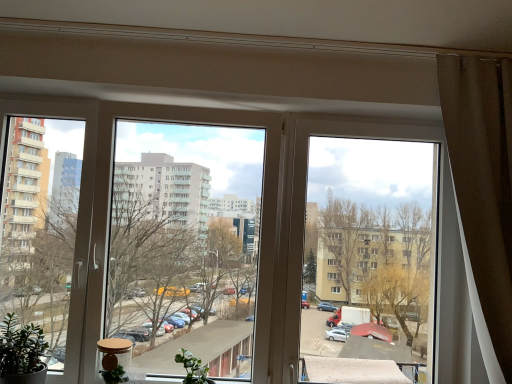
At what (x,y) coordinates should I click in order to perform the action: click on green matte plant at lower center, which appears as the 2th plant when viewed from the left. Please return your answer as a coordinate pair (x, y). Looking at the image, I should click on (193, 368).

This screenshot has height=384, width=512. What are the coordinates of `transparent glass window at center, acting as the second window starting from the left` in the screenshot? It's located at (367, 251).

Would you say green matte plant at lower center, which appears as the 2th plant when viewed from the left, is inside or outside green matte plant at lower left, placed as the second plant when sorted from right to left?

green matte plant at lower center, which appears as the 2th plant when viewed from the left, is outside green matte plant at lower left, placed as the second plant when sorted from right to left.

Is green matte plant at lower center, which appears as the 2th plant when viewed from the left, oriented away from green matte plant at lower left, arranged as the first plant when viewed from the left?

green matte plant at lower center, which appears as the 2th plant when viewed from the left, is not turned away from green matte plant at lower left, arranged as the first plant when viewed from the left.

Considering the relative sizes of green matte plant at lower center, which appears as the 2th plant when viewed from the left, and green matte plant at lower left, placed as the second plant when sorted from right to left, in the image provided, is green matte plant at lower center, which appears as the 2th plant when viewed from the left, bigger than green matte plant at lower left, placed as the second plant when sorted from right to left,?

Actually, green matte plant at lower center, which appears as the 2th plant when viewed from the left, might be smaller than green matte plant at lower left, placed as the second plant when sorted from right to left.

From the image's perspective, is green matte plant at lower center, which appears as the 2th plant when viewed from the left, located beneath green matte plant at lower left, arranged as the first plant when viewed from the left?

Correct, green matte plant at lower center, which appears as the 2th plant when viewed from the left, appears lower than green matte plant at lower left, arranged as the first plant when viewed from the left, in the image.

From the picture: Can you confirm if green matte plant at lower left, arranged as the first plant when viewed from the left, is bigger than transparent glass window at center, the 1th window from the right?

Actually, green matte plant at lower left, arranged as the first plant when viewed from the left, might be smaller than transparent glass window at center, the 1th window from the right.

From the image's perspective, is green matte plant at lower left, placed as the second plant when sorted from right to left, over transparent glass window at center, the 1th window from the right?

No, from the image's perspective, green matte plant at lower left, placed as the second plant when sorted from right to left, is not above transparent glass window at center, the 1th window from the right.

Is green matte plant at lower left, placed as the second plant when sorted from right to left, wider than transparent glass window at center, acting as the second window starting from the left?

Correct, the width of green matte plant at lower left, placed as the second plant when sorted from right to left, exceeds that of transparent glass window at center, acting as the second window starting from the left.

Is transparent glass window at center, acting as the second window starting from the left, surrounded by green matte plant at lower left, placed as the second plant when sorted from right to left?

No, green matte plant at lower left, placed as the second plant when sorted from right to left, does not contain transparent glass window at center, acting as the second window starting from the left.

Is transparent plastic window at center, which is counted as the 2th window, starting from the right, far from green matte plant at lower left, placed as the second plant when sorted from right to left?

Absolutely, transparent plastic window at center, which is counted as the 2th window, starting from the right, is distant from green matte plant at lower left, placed as the second plant when sorted from right to left.

Which is closer to the camera, (56, 315) or (15, 336)?

Point (56, 315).

Is transparent plastic window at center, which is counted as the 2th window, starting from the right, looking in the opposite direction of green matte plant at lower left, arranged as the first plant when viewed from the left?

Yes, transparent plastic window at center, which is counted as the 2th window, starting from the right, is positioned with its back facing green matte plant at lower left, arranged as the first plant when viewed from the left.

Is transparent plastic window at center, which is counted as the 2th window, starting from the right, smaller than green matte plant at lower left, arranged as the first plant when viewed from the left?

No, transparent plastic window at center, which is counted as the 2th window, starting from the right, is not smaller than green matte plant at lower left, arranged as the first plant when viewed from the left.

Would you say transparent glass window at center, acting as the second window starting from the left, is outside transparent plastic window at center, the 1th window when ordered from left to right?

Yes.

In the image, is transparent glass window at center, the 1th window from the right, on the left side or the right side of transparent plastic window at center, the 1th window when ordered from left to right?

Clearly, transparent glass window at center, the 1th window from the right, is on the right of transparent plastic window at center, the 1th window when ordered from left to right, in the image.

Which is less distant, [364,344] or [150,215]?

Point [364,344]

Find the location of a particular element. The image size is (512, 384). window that appears below the transparent glass window at center, the 1th window from the right (from a real-world perspective) is located at coordinates 156,234.

Does green matte plant at lower left, arranged as the first plant when viewed from the left, have a greater height compared to green matte plant at lower center, marked as the first plant in a right-to-left arrangement?

Indeed, green matte plant at lower left, arranged as the first plant when viewed from the left, has a greater height compared to green matte plant at lower center, marked as the first plant in a right-to-left arrangement.

Considering the points (33, 368) and (202, 367), which point is behind, point (33, 368) or point (202, 367)?

Positioned behind is point (202, 367).

Is green matte plant at lower left, placed as the second plant when sorted from right to left, to the left of green matte plant at lower center, marked as the first plant in a right-to-left arrangement, from the viewer's perspective?

Yes, green matte plant at lower left, placed as the second plant when sorted from right to left, is to the left of green matte plant at lower center, marked as the first plant in a right-to-left arrangement.

In terms of width, does green matte plant at lower left, placed as the second plant when sorted from right to left, look wider or thinner when compared to green matte plant at lower center, marked as the first plant in a right-to-left arrangement?

Considering their sizes, green matte plant at lower left, placed as the second plant when sorted from right to left, looks broader than green matte plant at lower center, marked as the first plant in a right-to-left arrangement.

From the image's perspective, who appears lower, green matte plant at lower left, arranged as the first plant when viewed from the left, or transparent plastic window at center, which is counted as the 2th window, starting from the right?

green matte plant at lower left, arranged as the first plant when viewed from the left, is shown below in the image.

At what (x,y) coordinates should I click in order to perform the action: click on plant on the left of transparent plastic window at center, which is counted as the 2th window, starting from the right. Please return your answer as a coordinate pair (x, y). The width and height of the screenshot is (512, 384). Looking at the image, I should click on (22, 353).

Is green matte plant at lower left, arranged as the first plant when viewed from the left, oriented away from transparent plastic window at center, which is counted as the 2th window, starting from the right?

Yes, green matte plant at lower left, arranged as the first plant when viewed from the left,'s orientation is away from transparent plastic window at center, which is counted as the 2th window, starting from the right.

Which object is closer to the camera taking this photo, green matte plant at lower center, which appears as the 2th plant when viewed from the left, or brown fabric curtain at right?

Positioned in front is brown fabric curtain at right.

Is green matte plant at lower center, which appears as the 2th plant when viewed from the left, thinner than brown fabric curtain at right?

Yes.

In the scene shown: Considering the sizes of objects green matte plant at lower center, which appears as the 2th plant when viewed from the left, and brown fabric curtain at right in the image provided, who is shorter, green matte plant at lower center, which appears as the 2th plant when viewed from the left, or brown fabric curtain at right?

Standing shorter between the two is green matte plant at lower center, which appears as the 2th plant when viewed from the left.

Measure the distance from green matte plant at lower center, marked as the first plant in a right-to-left arrangement, to brown fabric curtain at right.

A distance of 4.90 feet exists between green matte plant at lower center, marked as the first plant in a right-to-left arrangement, and brown fabric curtain at right.

At what (x,y) coordinates should I click in order to perform the action: click on plant located below the green matte plant at lower left, placed as the second plant when sorted from right to left (from the image's perspective). Please return your answer as a coordinate pair (x, y). This screenshot has height=384, width=512. Looking at the image, I should click on (193, 368).

In order to click on the 2nd window behind the green matte plant at lower left, placed as the second plant when sorted from right to left in this screenshot , I will do `click(367, 251)`.

From the image, which object appears to be farther from transparent glass window at center, the 1th window from the right, transparent plastic window at center, the 1th window when ordered from left to right, or green matte plant at lower left, placed as the second plant when sorted from right to left?

Based on the image, green matte plant at lower left, placed as the second plant when sorted from right to left, appears to be further to transparent glass window at center, the 1th window from the right.

From the image, which object appears to be farther from transparent plastic window at center, the 1th window when ordered from left to right, brown fabric curtain at right or transparent glass window at center, the 1th window from the right?

brown fabric curtain at right is further to transparent plastic window at center, the 1th window when ordered from left to right.

Based on their spatial positions, is transparent plastic window at center, which is counted as the 2th window, starting from the right, or green matte plant at lower center, which appears as the 2th plant when viewed from the left, closer to transparent glass window at center, acting as the second window starting from the left?

The object closer to transparent glass window at center, acting as the second window starting from the left, is transparent plastic window at center, which is counted as the 2th window, starting from the right.

Based on their spatial positions, is transparent glass window at center, the 1th window from the right, or brown fabric curtain at right further from green matte plant at lower center, marked as the first plant in a right-to-left arrangement?

The object further to green matte plant at lower center, marked as the first plant in a right-to-left arrangement, is transparent glass window at center, the 1th window from the right.

Based on the photo, when comparing their distances from green matte plant at lower left, arranged as the first plant when viewed from the left, does transparent plastic window at center, which is counted as the 2th window, starting from the right, or brown fabric curtain at right seem closer?

brown fabric curtain at right is positioned closer to the anchor green matte plant at lower left, arranged as the first plant when viewed from the left.

Based on their spatial positions, is transparent plastic window at center, the 1th window when ordered from left to right, or green matte plant at lower center, marked as the first plant in a right-to-left arrangement, further from brown fabric curtain at right?

Among the two, transparent plastic window at center, the 1th window when ordered from left to right, is located further to brown fabric curtain at right.

Looking at the image, which one is located closer to green matte plant at lower left, placed as the second plant when sorted from right to left, brown fabric curtain at right or transparent glass window at center, the 1th window from the right?

The object closer to green matte plant at lower left, placed as the second plant when sorted from right to left, is brown fabric curtain at right.

Which object lies further to the anchor point transparent plastic window at center, which is counted as the 2th window, starting from the right, green matte plant at lower left, arranged as the first plant when viewed from the left, or brown fabric curtain at right?

Based on the image, brown fabric curtain at right appears to be further to transparent plastic window at center, which is counted as the 2th window, starting from the right.

Where is `plant located between green matte plant at lower left, placed as the second plant when sorted from right to left, and transparent glass window at center, acting as the second window starting from the left, in the left-right direction`? This screenshot has width=512, height=384. plant located between green matte plant at lower left, placed as the second plant when sorted from right to left, and transparent glass window at center, acting as the second window starting from the left, in the left-right direction is located at coordinates (x=193, y=368).

Locate an element on the screen. window between transparent plastic window at center, the 1th window when ordered from left to right, and brown fabric curtain at right is located at coordinates (367, 251).

At what (x,y) coordinates should I click in order to perform the action: click on window situated between green matte plant at lower left, arranged as the first plant when viewed from the left, and green matte plant at lower center, which appears as the 2th plant when viewed from the left, from left to right. Please return your answer as a coordinate pair (x, y). Looking at the image, I should click on (x=156, y=234).

The image size is (512, 384). Identify the location of plant between transparent plastic window at center, which is counted as the 2th window, starting from the right, and brown fabric curtain at right from left to right. (193, 368).